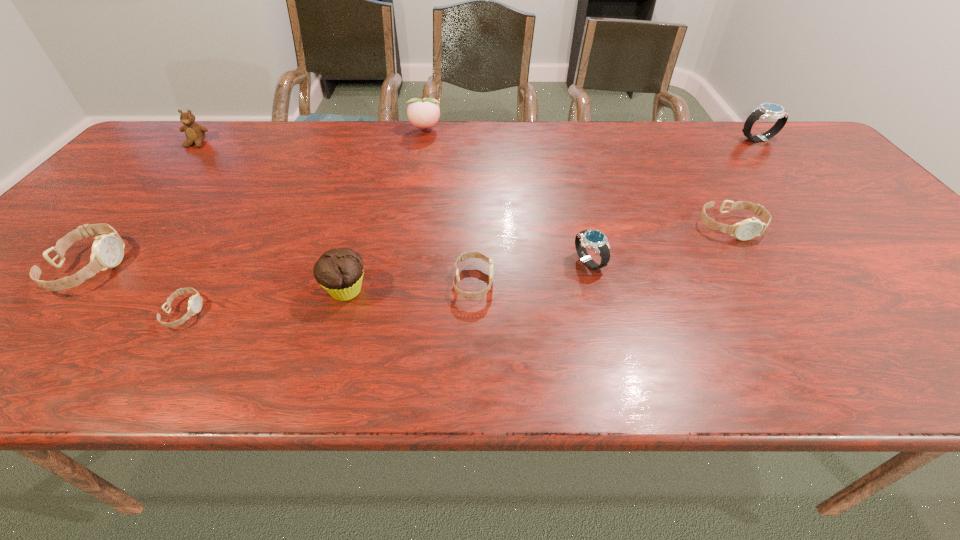
Find the location of a particular element. free location located on the right of the muffin is located at coordinates (466, 291).

You are a GUI agent. You are given a task and a screenshot of the screen. Output one action in this format:
    pyautogui.click(x=<x>, y=<y>)
    Task: Click on the free point located on the face of the biggest beige watch
    
    Given the screenshot: What is the action you would take?
    pyautogui.click(x=266, y=267)

Where is `vacant space located on the left of the nearer silver watch`? This screenshot has height=540, width=960. vacant space located on the left of the nearer silver watch is located at coordinates (542, 262).

Identify the location of vacant space located 0.170m on the face of the second biggest beige watch. The height and width of the screenshot is (540, 960). (773, 296).

This screenshot has height=540, width=960. Identify the location of free space located 0.100m on the face of the third biggest beige watch. (540, 282).

I want to click on free space located on the face of the fifth watch from right to left, so click(x=261, y=313).

Find the location of a particular element. Image resolution: width=960 pixels, height=540 pixels. peach positioned at the far edge is located at coordinates (424, 113).

The image size is (960, 540). In order to click on watch at the far edge in this screenshot , I will do `click(766, 110)`.

Find the location of `teddy bear that is at the far edge`. teddy bear that is at the far edge is located at coordinates (195, 134).

This screenshot has height=540, width=960. Find the location of `teddy bear that is at the left edge`. teddy bear that is at the left edge is located at coordinates (195, 134).